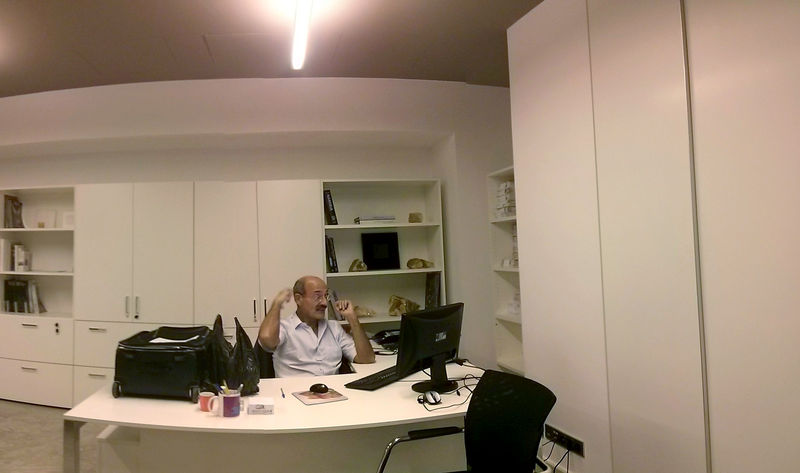
Find the location of a particular element. desk is located at coordinates (310, 449).